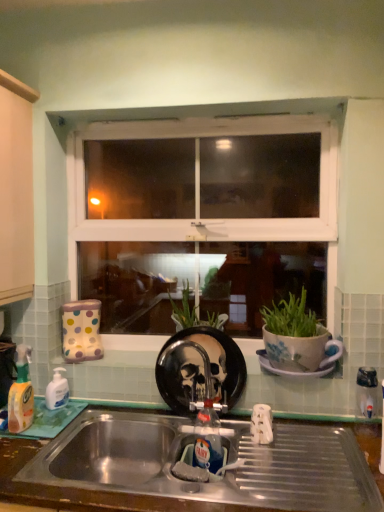
Question: Is white ceramic saucer at center in front of or behind stainless steel sink at lower center in the image?

Choices:
 (A) front
 (B) behind

Answer: (B)

Question: Considering the positions of point (329, 366) and point (243, 468), is point (329, 366) closer or farther from the camera than point (243, 468)?

Choices:
 (A) closer
 (B) farther

Answer: (B)

Question: Which object is positioned farthest from the matte wood cabinet at left?

Choices:
 (A) white ceramic saucer at center
 (B) translucent plastic bottle at left, the first bottle from the front
 (C) stainless steel sink at lower center
 (D) white opaque plastic bottle at left, arranged as the second bottle when viewed from the front
 (E) black glossy plate at center

Answer: (A)

Question: Considering the real-world distances, which object is closest to the metallic faucet at sink center?

Choices:
 (A) white plastic window at center
 (B) black glossy plate at center
 (C) matte wood cabinet at left
 (D) translucent plastic bottle at left, the first bottle from the front
 (E) stainless steel sink at lower center

Answer: (B)